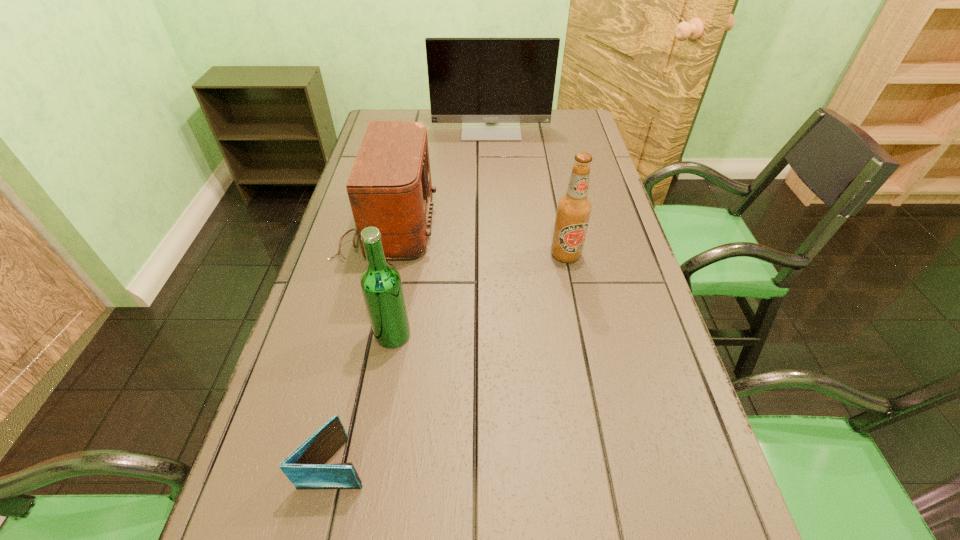
I want to click on vacant space located on the front panel of the radio receiver, so click(x=574, y=226).

The width and height of the screenshot is (960, 540). Find the location of `free space located on the exterior surface of the wallet`. free space located on the exterior surface of the wallet is located at coordinates (541, 462).

Where is `object present at the far edge`? The height and width of the screenshot is (540, 960). object present at the far edge is located at coordinates (490, 85).

Where is `radio receiver present at the left edge`? radio receiver present at the left edge is located at coordinates (389, 187).

The width and height of the screenshot is (960, 540). Identify the location of wallet that is at the left edge. (304, 467).

The height and width of the screenshot is (540, 960). What are the coordinates of `computer monitor located at the right edge` in the screenshot? It's located at (490, 85).

Locate an element on the screen. The width and height of the screenshot is (960, 540). beer bottle situated at the right edge is located at coordinates (573, 210).

You are a GUI agent. You are given a task and a screenshot of the screen. Output one action in this format:
    pyautogui.click(x=<x>, y=<y>)
    Task: Click on the object positioned at the far right corner
    The image size is (960, 540).
    Given the screenshot: What is the action you would take?
    pyautogui.click(x=490, y=85)

In the image, there is a desktop. Where is `vacant space at the left edge`? This screenshot has height=540, width=960. vacant space at the left edge is located at coordinates (346, 308).

Image resolution: width=960 pixels, height=540 pixels. Identify the location of vacant space at the right edge of the desktop. (700, 529).